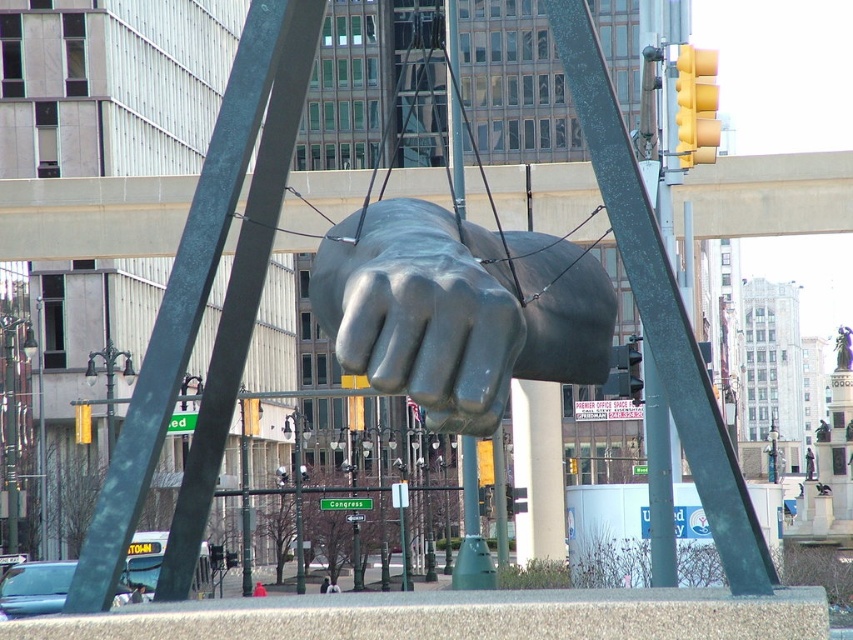
Who is more forward, (505, 323) or (664, 371)?

Point (505, 323) is in front.

Based on the photo, can you confirm if glossy metal fist at center is smaller than green patina pole at center?

Yes, glossy metal fist at center is smaller than green patina pole at center.

What do you see at coordinates (428, 330) in the screenshot? The image size is (853, 640). I see `glossy metal fist at center` at bounding box center [428, 330].

The height and width of the screenshot is (640, 853). In order to click on glossy metal fist at center in this screenshot , I will do `click(428, 330)`.

Can you confirm if green matte pole at left is smaller than glossy metal fist at center?

Actually, green matte pole at left might be larger than glossy metal fist at center.

Looking at this image, is green matte pole at left thinner than glossy metal fist at center?

Yes, green matte pole at left is thinner than glossy metal fist at center.

I want to click on green matte pole at left, so click(206, 301).

Locate an element on the screen. The width and height of the screenshot is (853, 640). green matte pole at left is located at coordinates (206, 301).

Is point (256, 17) positioned before point (564, 68)?

That is False.

How distant is green matte pole at left from green patina pole at center?

green matte pole at left and green patina pole at center are 5.04 meters apart from each other.

Who is more forward, (244,243) or (607,177)?

Positioned in front is point (607,177).

Where is `green matte pole at left`? green matte pole at left is located at coordinates (206, 301).